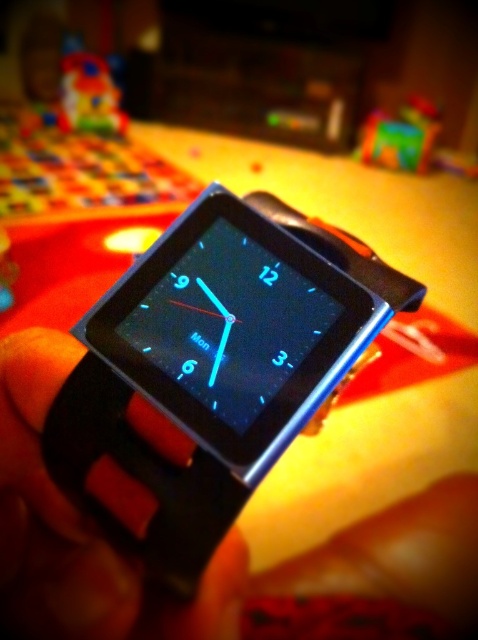
You are holding a smartwatch and notice two plastic toys in the background. Which toy, the rubberized plastic toy at upper right or the plastic toy at upper left, is nearer to your eyes?

The rubberized plastic toy at upper right is closer to the viewer than plastic toy at upper left.

Based on the photo, you are organizing a toy collection and notice two items in the image. The first is the rubberized plastic toy at upper right, and the second is the plastic toy at upper left. Which toy has a greater width?

The rubberized plastic toy at upper right has a greater width than the plastic toy at upper left.

You are a photographer holding a camera and want to take a closeup photo of the black rubber watch at center. The camera requires a minimum distance of 36 inches to focus properly. Can you take the photo from your current position?

The black rubber watch at center and camera are 36.64 inches apart, which is more than the required 36 inches, so yes, you can take the photo from your current position.